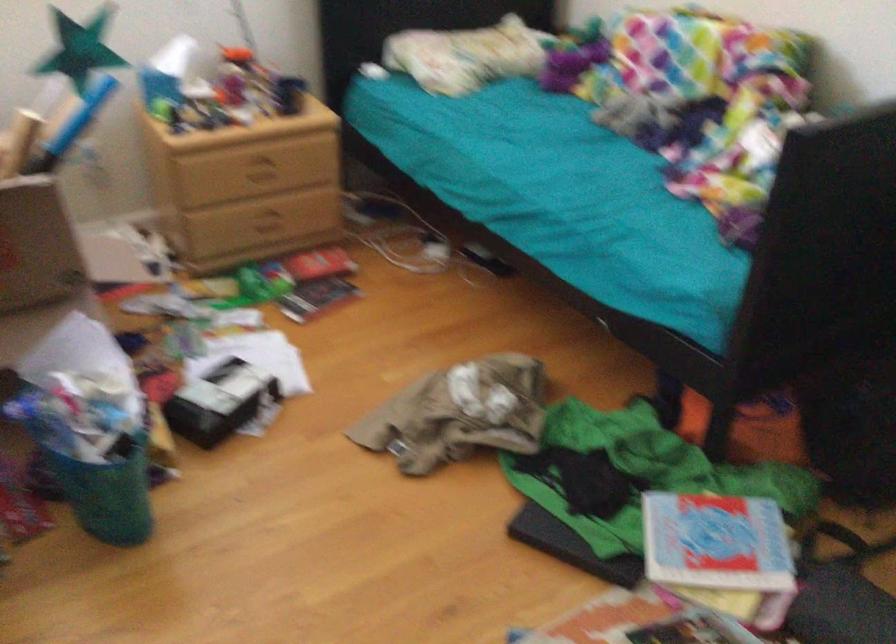
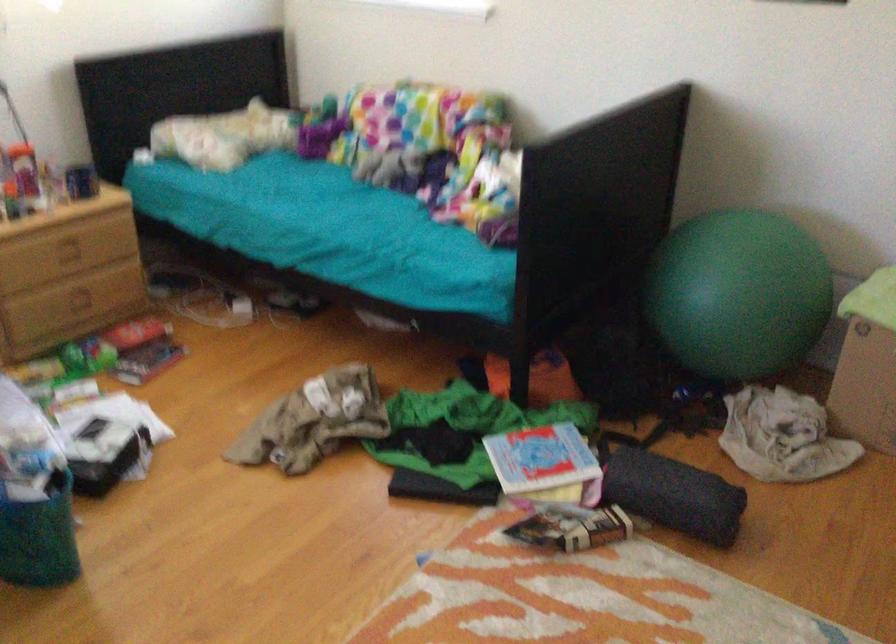
What movement of the cameraman would produce the second image?

The cameraman walked toward left, backward.